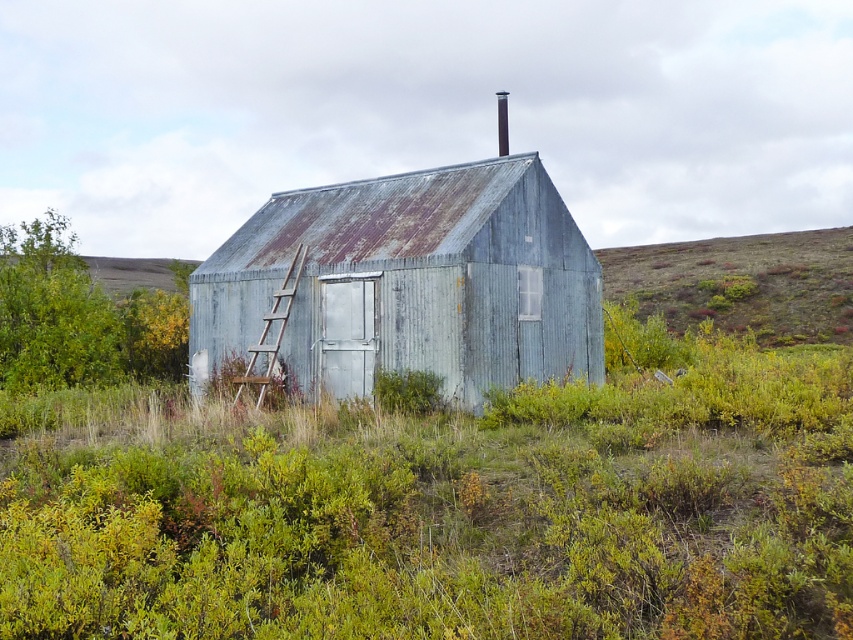
Can you confirm if rusty corrugated metal hut at center is positioned to the right of wooden ladder at center?

Indeed, rusty corrugated metal hut at center is positioned on the right side of wooden ladder at center.

Between rusty corrugated metal hut at center and wooden ladder at center, which one is positioned higher?

rusty corrugated metal hut at center

The height and width of the screenshot is (640, 853). What are the coordinates of `rusty corrugated metal hut at center` in the screenshot? It's located at (405, 284).